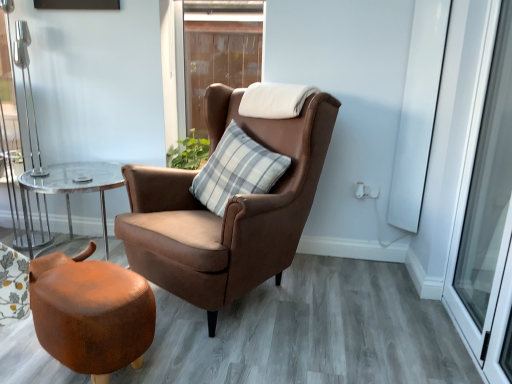
What do you see at coordinates (91, 313) in the screenshot?
I see `matte brown stool at lower left` at bounding box center [91, 313].

Find the location of a particular element. matte brown stool at lower left is located at coordinates (91, 313).

Locate an element on the screen. The width and height of the screenshot is (512, 384). brown wooden window at upper center is located at coordinates (219, 50).

Identify the location of clear glass table at left. This screenshot has height=384, width=512. (72, 187).

What do you see at coordinates (487, 222) in the screenshot? I see `transparent glass screen door at right, which is the 2th screen door from back to front` at bounding box center [487, 222].

Locate an element on the screen. The height and width of the screenshot is (384, 512). transparent glass screen door at right, which is the 2th screen door from back to front is located at coordinates (487, 222).

In order to face brown leather chair at center, should I rotate leftwards or rightwards?

You should rotate left by 4.170 degrees.

Where is `brown leather chair at center`? brown leather chair at center is located at coordinates (226, 210).

Identify the location of matte brown stool at lower left. This screenshot has width=512, height=384. (91, 313).

From a real-world perspective, which object rests below the other?

gray striped cushion at center, from a real-world perspective.

Which object is positioned more to the right, transparent glass screen door at right, marked as the 1th screen door in a front-to-back arrangement, or gray striped cushion at center?

transparent glass screen door at right, marked as the 1th screen door in a front-to-back arrangement.

Is transparent glass screen door at right, marked as the 1th screen door in a front-to-back arrangement, turned away from gray striped cushion at center?

No, gray striped cushion at center is not at the back of transparent glass screen door at right, marked as the 1th screen door in a front-to-back arrangement.

Is transparent glass screen door at right, marked as the 1th screen door in a front-to-back arrangement, next to gray striped cushion at center?

They are not placed beside each other.

From the image's perspective, would you say white glossy screen door at upper right, the first screen door in the back-to-front sequence, is positioned over gray striped cushion at center?

Yes, from the image's perspective, white glossy screen door at upper right, the first screen door in the back-to-front sequence, is above gray striped cushion at center.

Would you consider white glossy screen door at upper right, the first screen door in the back-to-front sequence, to be distant from gray striped cushion at center?

No, white glossy screen door at upper right, the first screen door in the back-to-front sequence, is in close proximity to gray striped cushion at center.

From a real-world perspective, is white glossy screen door at upper right, the first screen door in the back-to-front sequence, above or below gray striped cushion at center?

white glossy screen door at upper right, the first screen door in the back-to-front sequence, is above gray striped cushion at center.

Between point (440, 26) and point (260, 182), which one is positioned in front?

The point (260, 182) is closer.

In the scene shown: From the image's perspective, is white glossy screen door at upper right, the first screen door in the back-to-front sequence, located above brown leather chair at center?

Yes, from the image's perspective, white glossy screen door at upper right, the first screen door in the back-to-front sequence, is above brown leather chair at center.

How many degrees apart are the facing directions of white glossy screen door at upper right, the first screen door in the back-to-front sequence, and brown leather chair at center?

The facing directions of white glossy screen door at upper right, the first screen door in the back-to-front sequence, and brown leather chair at center are 9.86 degrees apart.

Could brown leather chair at center be considered to be inside white glossy screen door at upper right, the first screen door in the back-to-front sequence?

No.

Is there a large distance between white glossy screen door at upper right, the first screen door in the back-to-front sequence, and brown leather chair at center?

white glossy screen door at upper right, the first screen door in the back-to-front sequence, is actually quite close to brown leather chair at center.

From a real-world perspective, is white glossy screen door at upper right, the second screen door in the front-to-back sequence, above or below transparent glass screen door at right, which is the 2th screen door from back to front?

white glossy screen door at upper right, the second screen door in the front-to-back sequence, is above transparent glass screen door at right, which is the 2th screen door from back to front.

Which of these two, white glossy screen door at upper right, the second screen door in the front-to-back sequence, or transparent glass screen door at right, marked as the 1th screen door in a front-to-back arrangement, stands shorter?

With less height is white glossy screen door at upper right, the second screen door in the front-to-back sequence.

Which object is positioned more to the left, white glossy screen door at upper right, the first screen door in the back-to-front sequence, or transparent glass screen door at right, marked as the 1th screen door in a front-to-back arrangement?

From the viewer's perspective, white glossy screen door at upper right, the first screen door in the back-to-front sequence, appears more on the left side.

Is green leafy plant at upper center completely or partially outside of clear glass table at left?

Yes, green leafy plant at upper center is located beyond the bounds of clear glass table at left.

Between green leafy plant at upper center and clear glass table at left, which one is positioned behind?

green leafy plant at upper center is more distant.

Between green leafy plant at upper center and clear glass table at left, which one has larger width?

With larger width is clear glass table at left.

Does point (187, 160) come behind point (92, 166)?

No, (187, 160) is in front of (92, 166).

From the image's perspective, is green leafy plant at upper center positioned above or below matte brown stool at lower left?

green leafy plant at upper center is situated higher than matte brown stool at lower left in the image.

From a real-world perspective, is green leafy plant at upper center above or below matte brown stool at lower left?

green leafy plant at upper center is situated higher than matte brown stool at lower left in the real world.

Who is smaller, green leafy plant at upper center or matte brown stool at lower left?

Smaller between the two is green leafy plant at upper center.

Considering the sizes of brown leather chair at center and clear glass table at left in the image, is brown leather chair at center wider or thinner than clear glass table at left?

Clearly, brown leather chair at center has more width compared to clear glass table at left.

From the picture: Is there a large distance between brown leather chair at center and clear glass table at left?

No, brown leather chair at center is not far from clear glass table at left.

Is brown leather chair at center looking in the opposite direction of clear glass table at left?

brown leather chair at center does not have its back to clear glass table at left.

Does brown leather chair at center appear on the left side of clear glass table at left?

In fact, brown leather chair at center is to the right of clear glass table at left.

Locate an element on the screen. screen door that appears below the gray striped cushion at center (from the image's perspective) is located at coordinates (487, 222).

The height and width of the screenshot is (384, 512). In order to click on screen door above the gray striped cushion at center (from the image's perspective) in this screenshot , I will do `click(418, 112)`.

Consider the image. Which object lies further to the anchor point gray striped cushion at center, clear glass table at left or brown leather chair at center?

The object further to gray striped cushion at center is clear glass table at left.

When comparing their distances from green leafy plant at upper center, does brown leather chair at center or clear glass table at left seem further?

Based on the image, brown leather chair at center appears to be further to green leafy plant at upper center.

Looking at the image, which one is located further to brown leather chair at center, transparent glass screen door at right, marked as the 1th screen door in a front-to-back arrangement, or gray striped cushion at center?

transparent glass screen door at right, marked as the 1th screen door in a front-to-back arrangement, is further to brown leather chair at center.

When comparing their distances from matte brown stool at lower left, does white glossy screen door at upper right, the first screen door in the back-to-front sequence, or brown leather chair at center seem closer?

Among the two, brown leather chair at center is located nearer to matte brown stool at lower left.

Which object lies nearer to the anchor point gray striped cushion at center, green leafy plant at upper center or transparent glass screen door at right, marked as the 1th screen door in a front-to-back arrangement?

Based on the image, green leafy plant at upper center appears to be nearer to gray striped cushion at center.

When comparing their distances from white glossy screen door at upper right, the first screen door in the back-to-front sequence, does transparent glass screen door at right, marked as the 1th screen door in a front-to-back arrangement, or clear glass table at left seem closer?

The object closer to white glossy screen door at upper right, the first screen door in the back-to-front sequence, is transparent glass screen door at right, marked as the 1th screen door in a front-to-back arrangement.

Estimate the real-world distances between objects in this image. Which object is closer to brown leather chair at center, matte brown stool at lower left or transparent glass screen door at right, marked as the 1th screen door in a front-to-back arrangement?

matte brown stool at lower left.

Considering their positions, is brown wooden window at upper center positioned further to white glossy screen door at upper right, the first screen door in the back-to-front sequence, than clear glass table at left?

brown wooden window at upper center is positioned further to the anchor white glossy screen door at upper right, the first screen door in the back-to-front sequence.

This screenshot has width=512, height=384. I want to click on table between brown leather chair at center and brown wooden window at upper center along the z-axis, so click(72, 187).

Locate an element on the screen. Image resolution: width=512 pixels, height=384 pixels. screen door situated between clear glass table at left and transparent glass screen door at right, which is the 2th screen door from back to front, from left to right is located at coordinates pos(418,112).

Where is `chair located between brown wooden window at upper center and white glossy screen door at upper right, the first screen door in the back-to-front sequence, in the left-right direction`? Image resolution: width=512 pixels, height=384 pixels. chair located between brown wooden window at upper center and white glossy screen door at upper right, the first screen door in the back-to-front sequence, in the left-right direction is located at coordinates (226, 210).

You are a GUI agent. You are given a task and a screenshot of the screen. Output one action in this format:
    pyautogui.click(x=<x>, y=<y>)
    Task: Click on the screen door between gray striped cushion at center and transparent glass screen door at right, marked as the 1th screen door in a front-to-back arrangement, in the horizontal direction
    This screenshot has width=512, height=384.
    Given the screenshot: What is the action you would take?
    pyautogui.click(x=418, y=112)